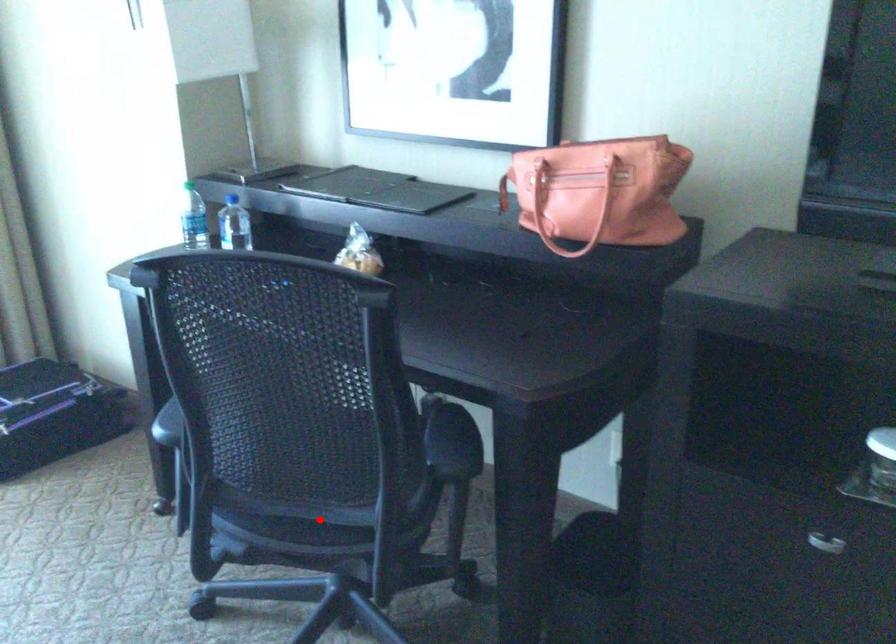
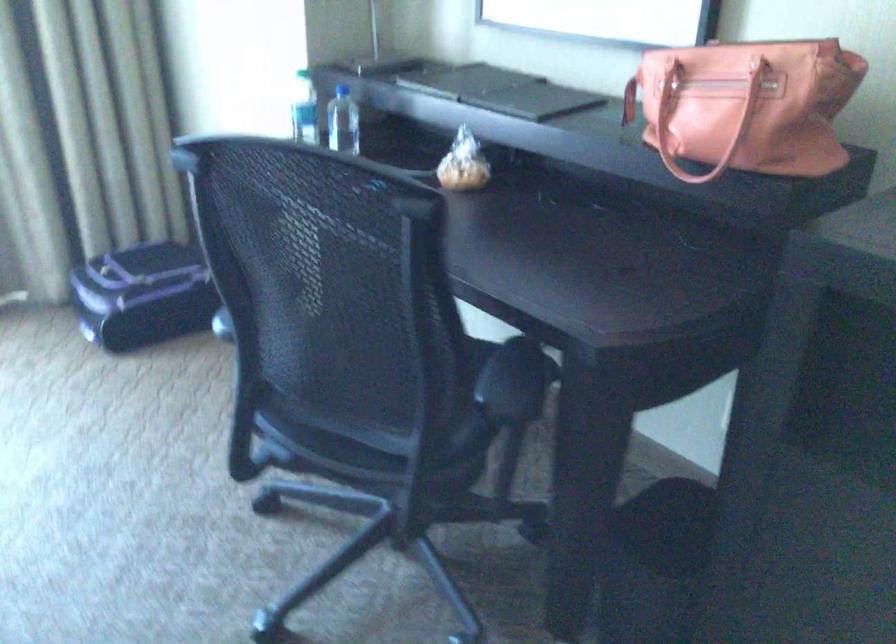
Where in the second image is the point corresponding to the highlighted location from the first image?

(364, 440)